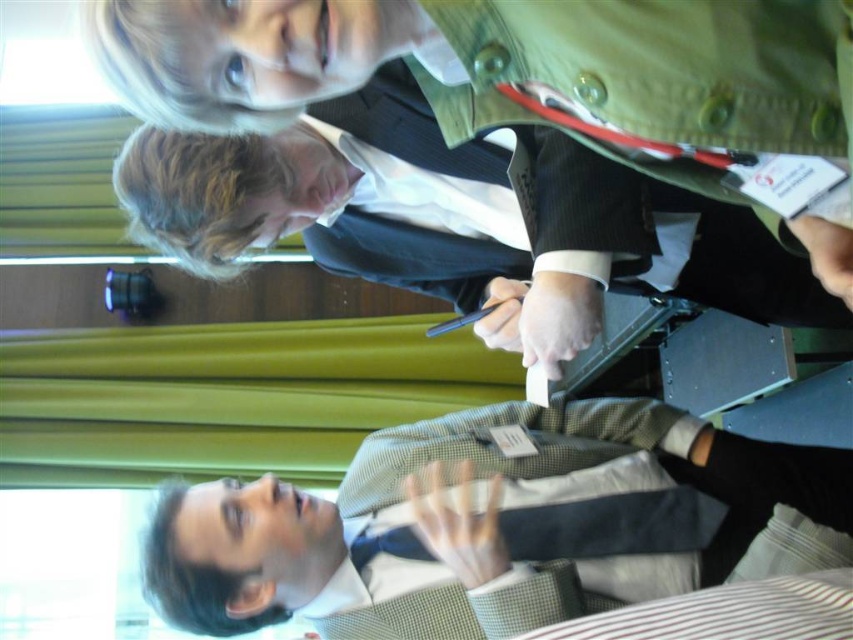
Based on the scene description, which object is positioned higher up in the image, the checkered fabric shirt at lower center or the dark green textured jacket at upper center?

The dark green textured jacket at upper center is positioned higher up in the image compared to the checkered fabric shirt at lower center.